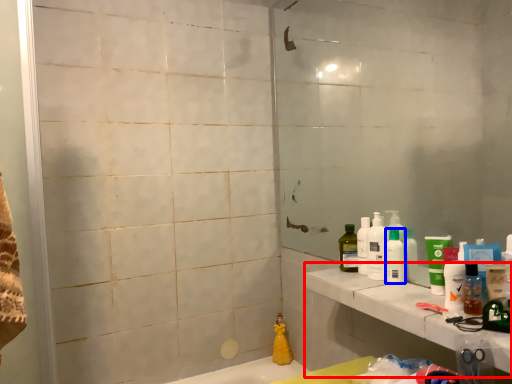
Question: Which point is closer to the camera, counter top (highlighted by a red box) or toiletry (highlighted by a blue box)?

Choices:
 (A) counter top
 (B) toiletry

Answer: (A)